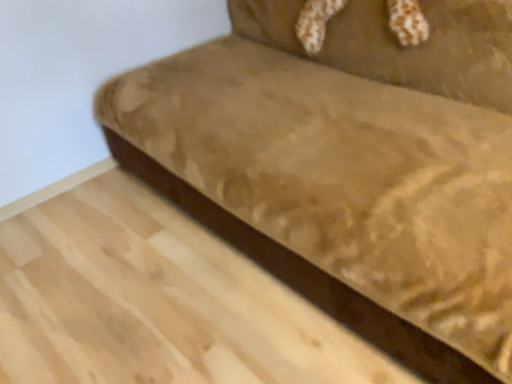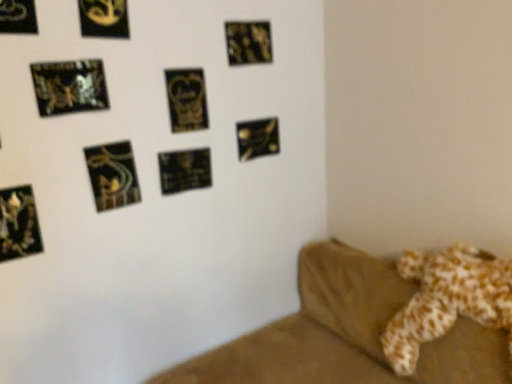
Question: How did the camera likely rotate when shooting the video?

Choices:
 (A) rotated downward
 (B) rotated upward

Answer: (B)